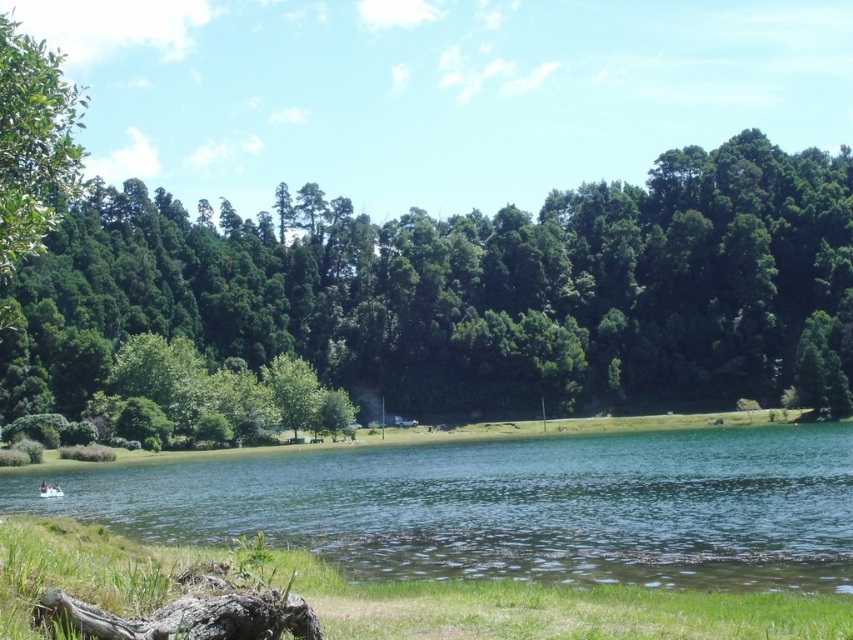
You are standing at the point with coordinates point (x=270, y=621) and want to walk towards the point (x=605, y=195). Will you be moving towards the background or the foreground of the image?

Since point (x=605, y=195) is behind point (x=270, y=621), moving towards it would mean you are heading toward the background of the image.

You are standing at the lakeside and want to find a spot to place a picnic blanket. You see the green leafy tree at center and the green grass at lower center. Which location would be better for shade and a clear view of the lake?

The green leafy tree at center is located above green grass at lower center, so placing the picnic blanket under the green leafy tree at center would provide shade. However, since it is above the grass, it might block the view of the lake. The green grass at lower center is lower and closer to the water, offering a clearer view but less shade. Choose based on preference between shade or view.

You are standing at the lakeside and want to walk towards the green liquid water at center. Which direction should you move relative to the green grass at lower center?

You should move downward towards the green liquid water at center since it is located below the green grass at lower center.